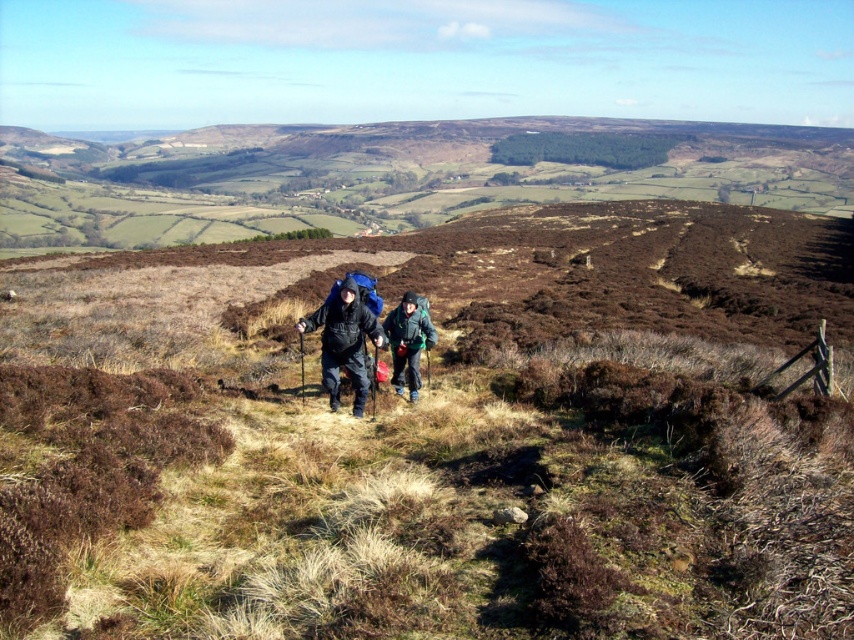
Question: Observing the image, what is the correct spatial positioning of matte black backpack at center in reference to dark green fabric jacket at center?

Choices:
 (A) right
 (B) left

Answer: (B)

Question: Can you confirm if brown dry grass at center is smaller than dark green fabric jacket at center?

Choices:
 (A) yes
 (B) no

Answer: (B)

Question: Which point is closer to the camera?

Choices:
 (A) (408, 369)
 (B) (709, 253)

Answer: (A)

Question: Does brown dry grass at center appear on the left side of dark green fabric jacket at center?

Choices:
 (A) yes
 (B) no

Answer: (A)

Question: Which point is closer to the camera?

Choices:
 (A) matte black backpack at center
 (B) brown dry grass at center
 (C) dark green fabric jacket at center

Answer: (B)

Question: Estimate the real-world distances between objects in this image. Which object is farther from the matte black backpack at center?

Choices:
 (A) dark green fabric jacket at center
 (B) brown dry grass at center

Answer: (B)